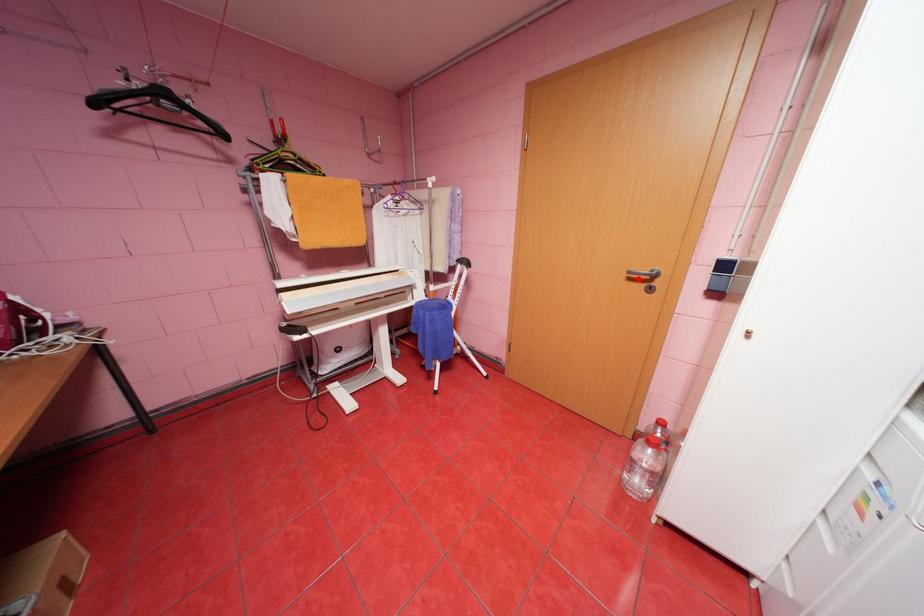
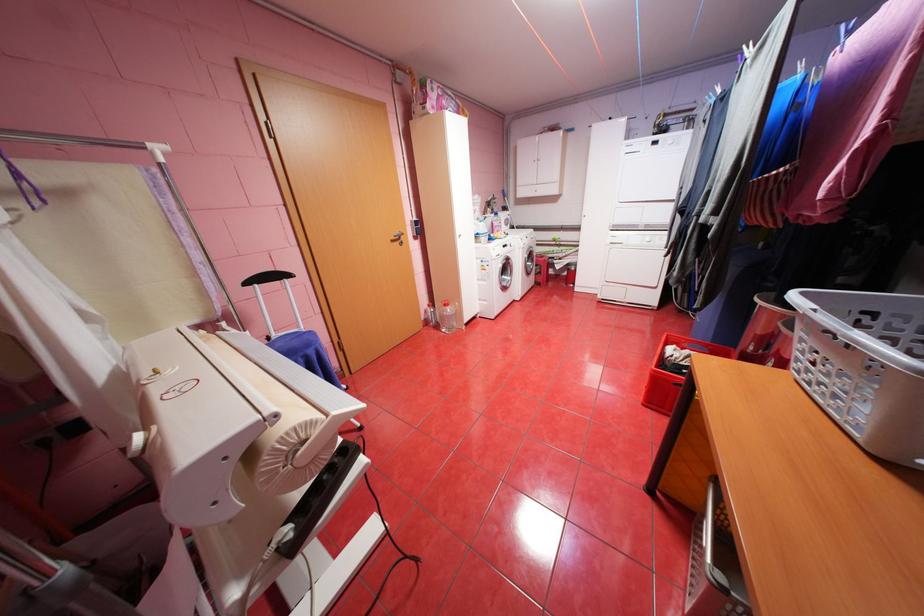
Question: I am providing you with two images of the same scene from different viewpoints. Given a red point in image1, look at the same physical point in image2. Is it:

Choices:
 (A) Closer to the viewpoint
 (B) Farther from the viewpoint

Answer: (A)